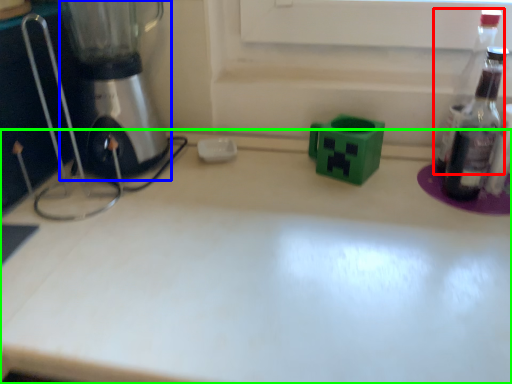
Question: Based on their relative distances, which object is nearer to bottle (highlighted by a red box)? Choose from mixer (highlighted by a blue box) and countertop (highlighted by a green box).

Choices:
 (A) mixer
 (B) countertop

Answer: (B)